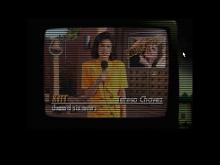
Locate an element on the screen. This screenshot has height=165, width=220. tv is located at coordinates (173, 27).